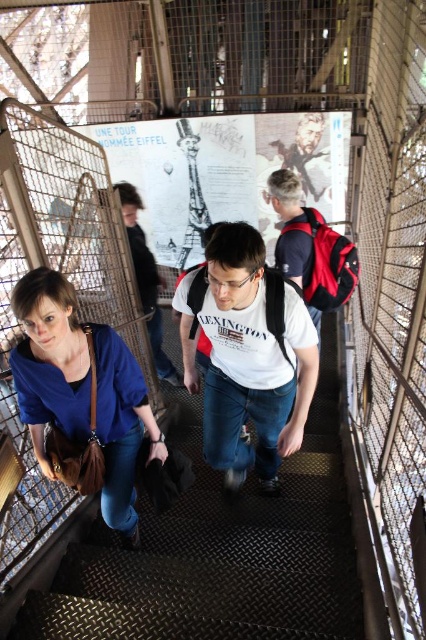
You are a tour guide explaining the Eiffel Tower staircase to a visitor. Point out the location of the blue fabric shirt at lower left relative to the matte white poster at center. Is the poster above or below the shirt?

The matte white poster at center is positioned over the blue fabric shirt at lower left, meaning the poster is above the shirt.

Consider the image. You are standing at the base of the Eiffel Tower staircase and want to take a photo of the two points marked on the image. Which point, point (x=267, y=445) or point (x=140, y=280), will appear larger in your photo?

Point (x=267, y=445) will appear larger in the photo because it is closer to the camera than point (x=140, y=280).